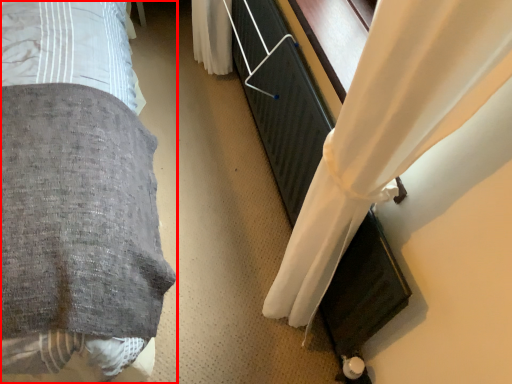
Question: From the image's perspective, considering the relative positions of bed (annotated by the red box) and curtain in the image provided, where is bed (annotated by the red box) located with respect to the staircase?

Choices:
 (A) above
 (B) below

Answer: (A)